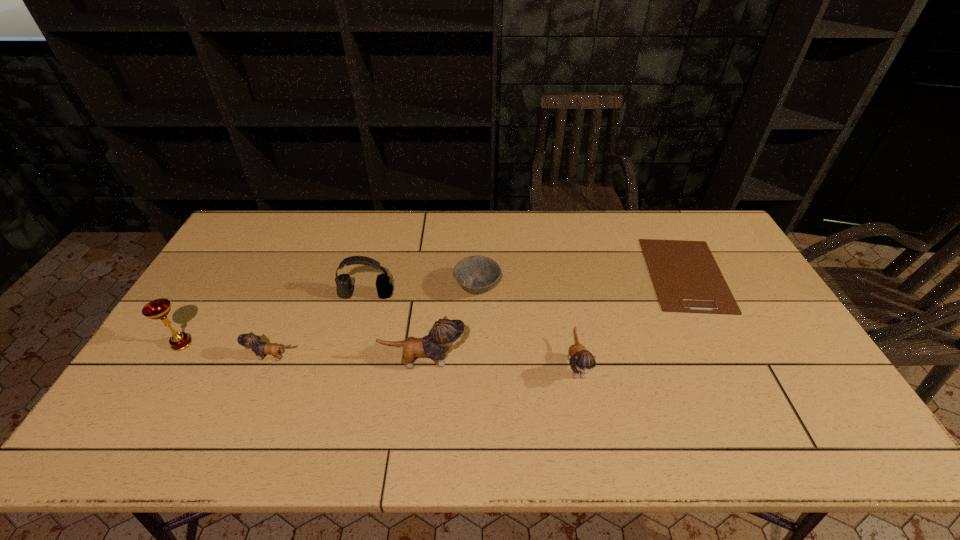
Find the location of a particular element. This screenshot has height=540, width=960. the second object from left to right is located at coordinates (251, 341).

Where is `the leftmost kitten`? the leftmost kitten is located at coordinates (251, 341).

At what (x,y) coordinates should I click in order to perform the action: click on the tallest kitten. Please return your answer as a coordinate pair (x, y). Looking at the image, I should click on (445, 333).

At what (x,y) coordinates should I click in order to perform the action: click on the fourth tallest object. Please return your answer as a coordinate pair (x, y). The image size is (960, 540). Looking at the image, I should click on (582, 361).

At what (x,y) coordinates should I click in order to perform the action: click on the second object from right to left. Please return your answer as a coordinate pair (x, y). Looking at the image, I should click on (582, 361).

Where is `clipboard`? This screenshot has width=960, height=540. clipboard is located at coordinates tap(687, 279).

The width and height of the screenshot is (960, 540). Find the location of `the rightmost object`. the rightmost object is located at coordinates (687, 279).

Identify the location of the fifth object from right to left. The width and height of the screenshot is (960, 540). pyautogui.click(x=344, y=289).

Find the location of a particular element. Image resolution: width=960 pixels, height=540 pixels. the leftmost object is located at coordinates (159, 308).

You are a GUI agent. You are given a task and a screenshot of the screen. Output one action in this format:
    pyautogui.click(x=<x>, y=<y>)
    Task: Click on the bowl
    
    Given the screenshot: What is the action you would take?
    pyautogui.click(x=476, y=274)